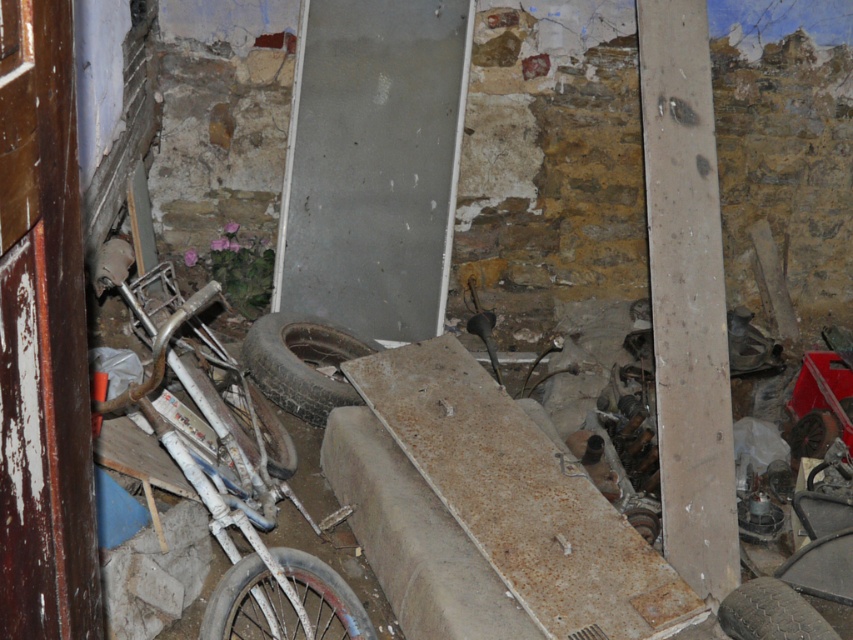
Does rusty metal bicycle at lower left have a greater width compared to black rubber tire at center?

Correct, the width of rusty metal bicycle at lower left exceeds that of black rubber tire at center.

Is rusty metal bicycle at lower left further to camera compared to black rubber tire at center?

No, it is not.

The image size is (853, 640). I want to click on rusty metal bicycle at lower left, so click(234, 502).

Image resolution: width=853 pixels, height=640 pixels. In order to click on rusty metal bicycle at lower left in this screenshot , I will do `click(234, 502)`.

Can you confirm if rusty metal bicycle at lower left is bigger than rusty metal tire at center?

Yes, rusty metal bicycle at lower left is bigger than rusty metal tire at center.

Is rusty metal bicycle at lower left wider than rusty metal tire at center?

Correct, the width of rusty metal bicycle at lower left exceeds that of rusty metal tire at center.

Locate an element on the screen. The image size is (853, 640). rusty metal bicycle at lower left is located at coordinates (234, 502).

Between point (207, 412) and point (792, 605), which one is positioned behind?

Positioned behind is point (207, 412).

Image resolution: width=853 pixels, height=640 pixels. Find the location of `rusty metal bicycle at lower left`. rusty metal bicycle at lower left is located at coordinates (234, 502).

Between point (131, 256) and point (838, 636), which one is positioned behind?

The point (131, 256) is more distant.

You are a GUI agent. You are given a task and a screenshot of the screen. Output one action in this format:
    pyautogui.click(x=<x>, y=<y>)
    Task: Click on the rusty metal bicycle at lower left
    The image size is (853, 640).
    Given the screenshot: What is the action you would take?
    pyautogui.click(x=234, y=502)